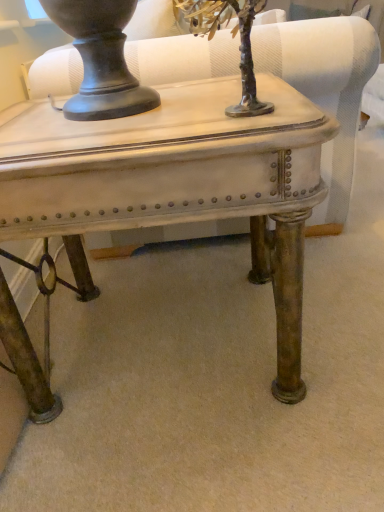
Where is `vacant region below metallic silver tree at upper center (from a real-world perspective)`? Image resolution: width=384 pixels, height=512 pixels. vacant region below metallic silver tree at upper center (from a real-world perspective) is located at coordinates (205, 108).